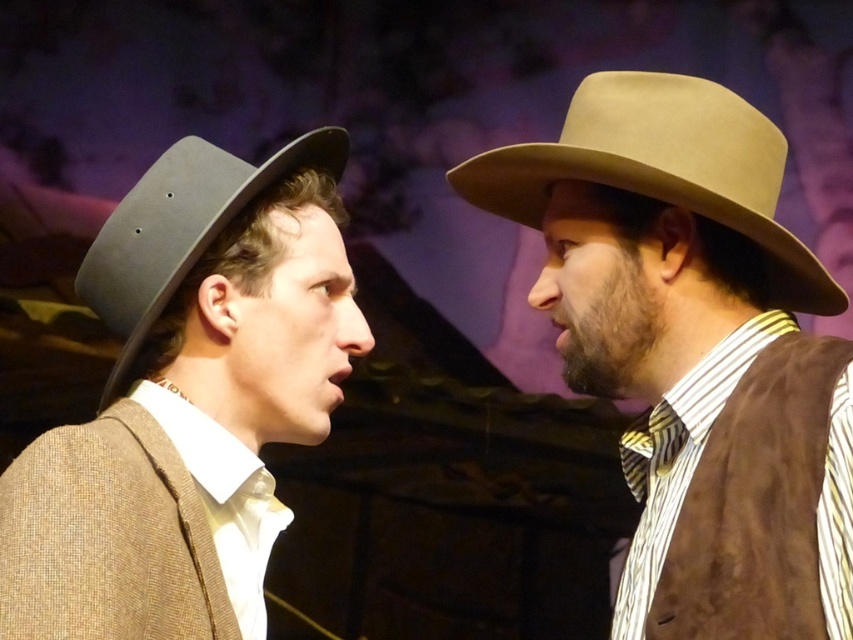
Can you confirm if beige felt hat at center is wider than suede-like beige cowboy hat at right?

Indeed, beige felt hat at center has a greater width compared to suede-like beige cowboy hat at right.

Between point (548, 205) and point (578, 138), which one is positioned in front?

Positioned in front is point (578, 138).

Identify the location of beige felt hat at center. This screenshot has width=853, height=640. (695, 346).

From the picture: Can you confirm if suede-like beige cowboy hat at right is positioned above striped fabric tie at right?

Yes.

Which is in front, point (769, 122) or point (666, 410)?

Positioned in front is point (666, 410).

Identify the location of suede-like beige cowboy hat at right. (663, 168).

Between point (743, 556) and point (653, 500), which one is positioned behind?

Point (653, 500)

Does beige felt hat at center appear on the left side of striped fabric tie at right?

Correct, you'll find beige felt hat at center to the left of striped fabric tie at right.

Which is behind, point (612, 392) or point (683, 454)?

Point (612, 392)

The width and height of the screenshot is (853, 640). In order to click on beige felt hat at center in this screenshot , I will do `click(695, 346)`.